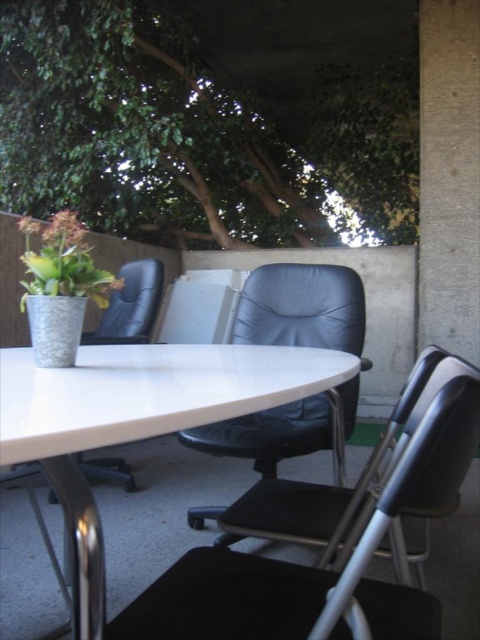
Looking at this image, you are planning to rearrange the seating area to accommodate more guests. Given the sizes of the black leather chair at center and the green matte plant at upper left, which object would you move to free up space?

The black leather chair at center is bigger than the green matte plant at upper left, so moving the black leather chair at center would free up more space.

You are sitting on the matte black chair at center and want to enjoy the shade provided by the green leafy tree at upper center. Is the tree positioned in a way that it can shade you effectively?

The green leafy tree at upper center is positioned over the matte black chair at center, so yes, the tree is directly above the chair and should provide effective shade.

You are planning to install a hanging light fixture between the green leafy tree at upper center and the matte black chair at center. The fixture requires a minimum of 7 feet of space between the two points to be safely installed. Based on the distance provided, is this installation feasible?

The green leafy tree at upper center is 9.09 feet from the matte black chair at center, which exceeds the minimum required 7 feet. Therefore, installing the hanging light fixture between them is feasible.